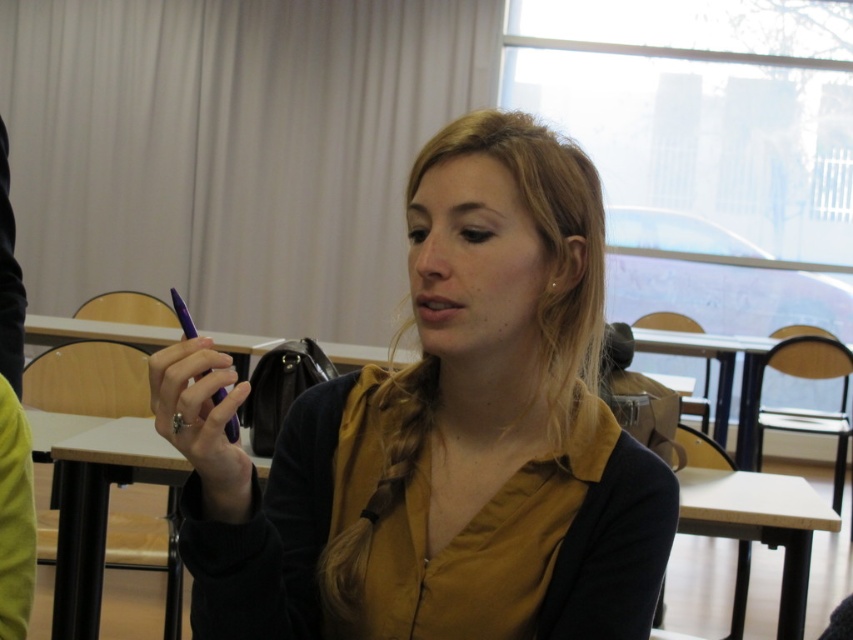
Who is more forward, (x=444, y=358) or (x=216, y=397)?

Point (x=216, y=397) is in front.

Is matte purple pen at center smaller than purple glossy pen at center?

Yes, matte purple pen at center is smaller than purple glossy pen at center.

The height and width of the screenshot is (640, 853). I want to click on matte purple pen at center, so click(440, 436).